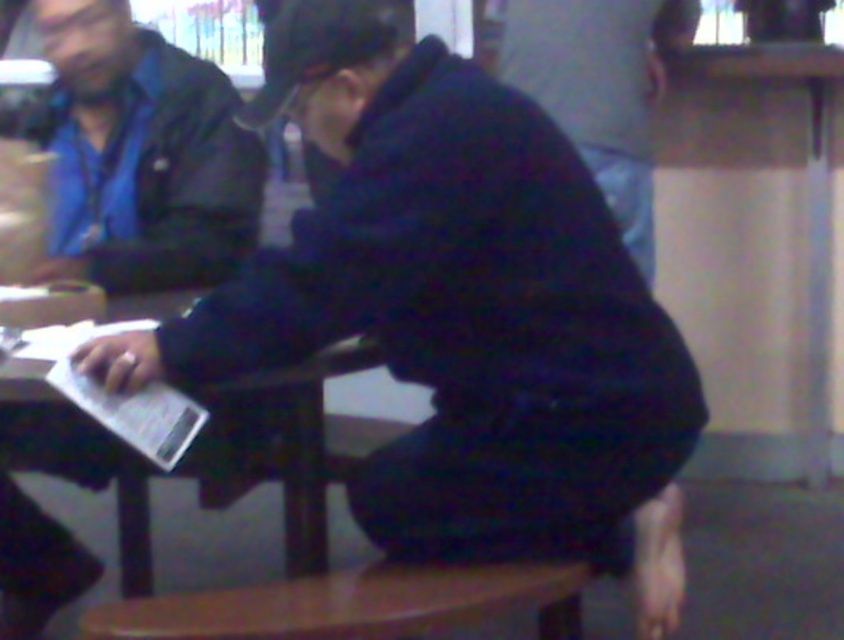
Find the location of a particular element. wooden table at center is located at coordinates (42, 509).

Measure the distance between point (101, 564) and camera.

Point (101, 564) and camera are 7.22 feet apart from each other.

Is point (3, 492) farther from camera compared to point (555, 68)?

No, it is in front of (555, 68).

Image resolution: width=844 pixels, height=640 pixels. Identify the location of wooden table at center. (42, 509).

Who is positioned more to the right, matte black jacket at upper left or dark blue fabric at center?

dark blue fabric at center

The height and width of the screenshot is (640, 844). I want to click on matte black jacket at upper left, so click(142, 156).

Is wooden stool at lower center bigger than dark blue fabric at center?

Actually, wooden stool at lower center might be smaller than dark blue fabric at center.

This screenshot has width=844, height=640. Describe the element at coordinates (353, 604) in the screenshot. I see `wooden stool at lower center` at that location.

Is point (261, 598) closer to viewer compared to point (647, 186)?

Yes, point (261, 598) is in front of point (647, 186).

Locate an element on the screen. The height and width of the screenshot is (640, 844). wooden stool at lower center is located at coordinates (353, 604).